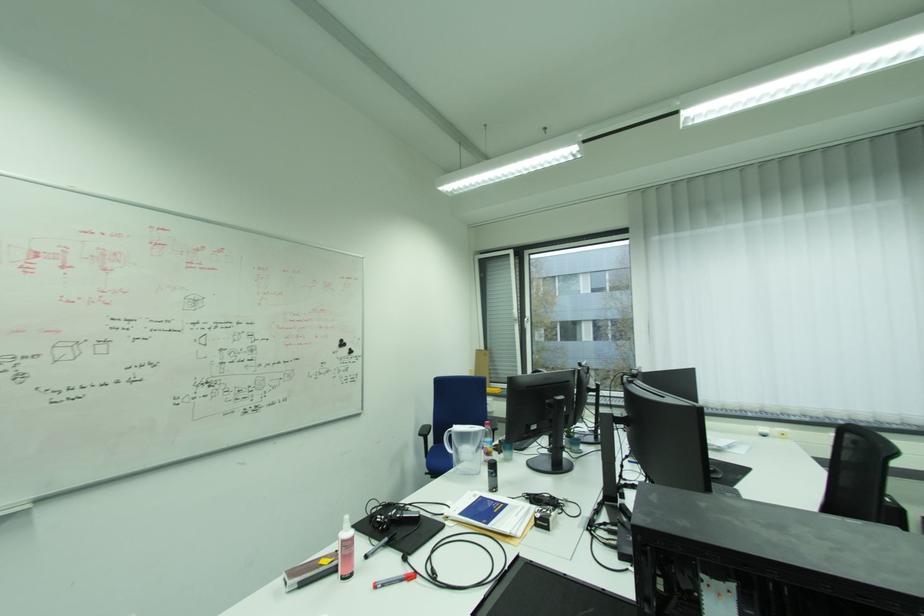
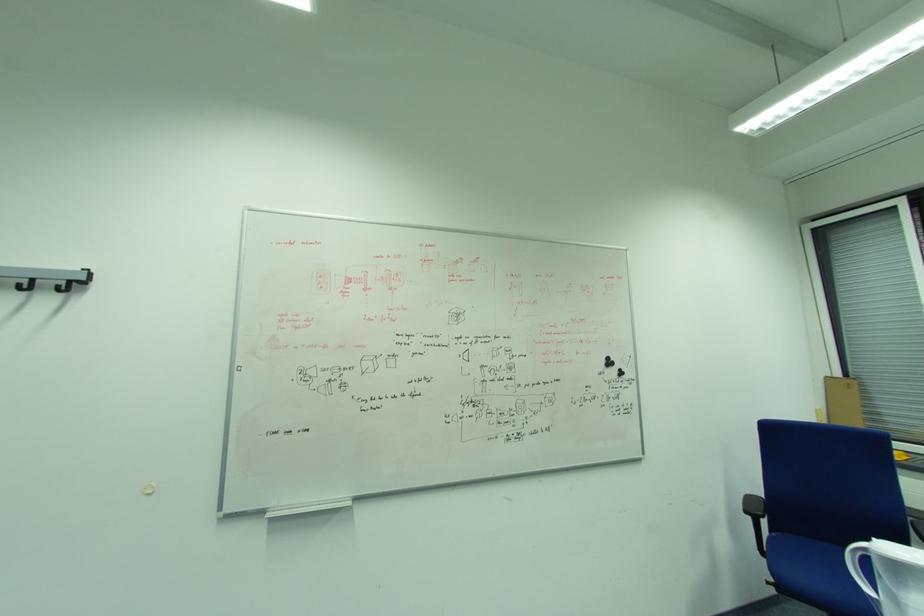
Question: The camera is either moving clockwise (left) or counter-clockwise (right) around the object. The first image is from the beginning of the video and the second image is from the end. Is the camera moving left or right when shooting the video?

Choices:
 (A) Left
 (B) Right

Answer: (B)